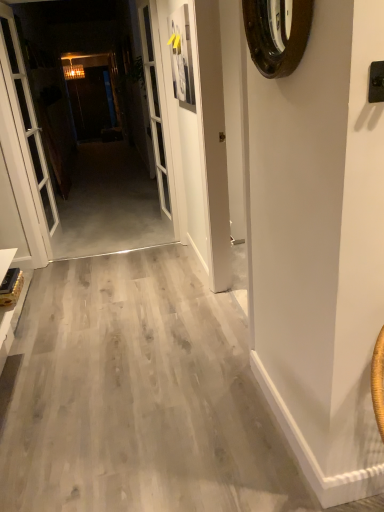
The image size is (384, 512). What are the coordinates of `free spot in front of concrete floor at center` in the screenshot? It's located at (112, 233).